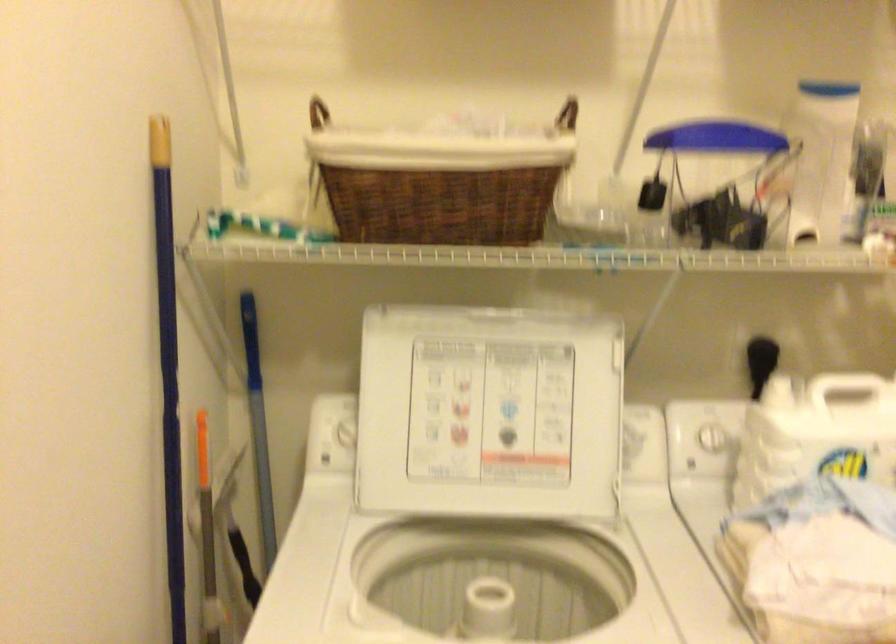
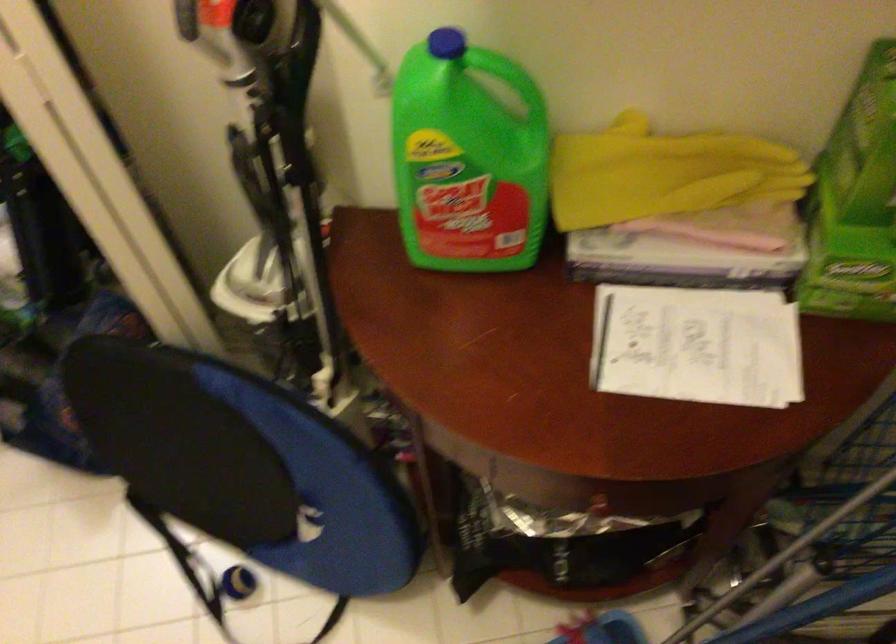
In the scene shown: Based on the continuous images, in which direction is the camera rotating?

The rotation direction of the camera is right-down.